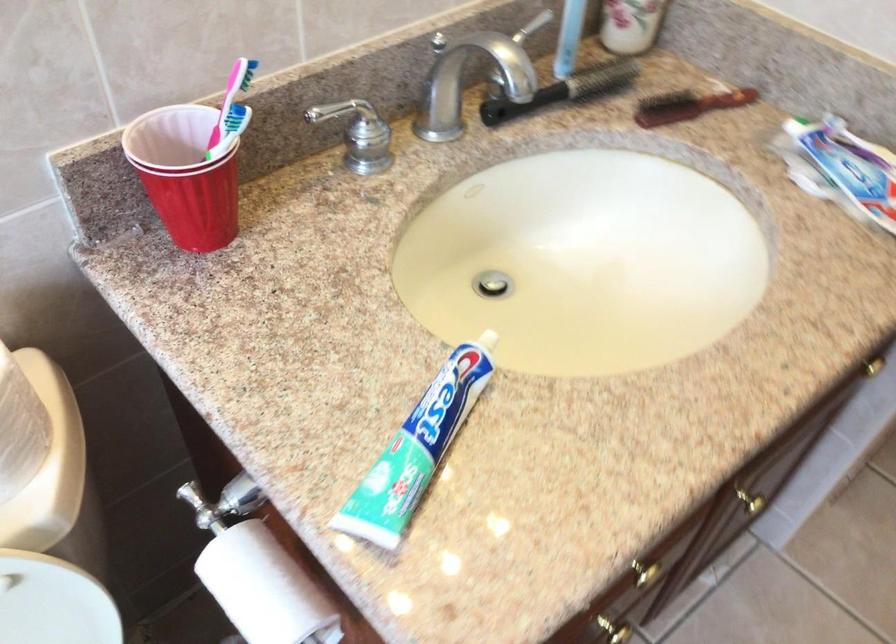
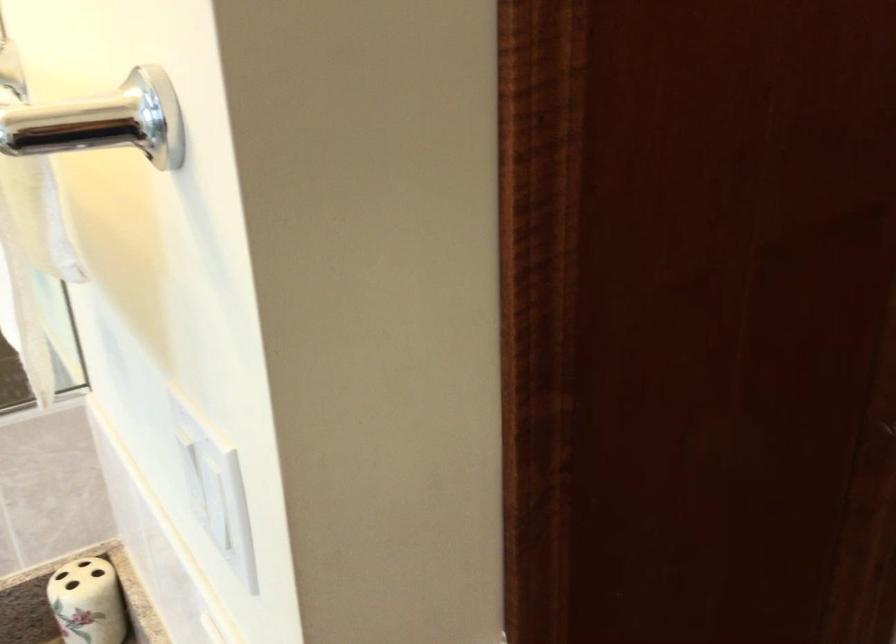
Question: Based on the continuous images, in which direction is the camera rotating? Reply with the corresponding letter.

Choices:
 (A) Left
 (B) Right
 (C) Up
 (D) Down

Answer: (C)